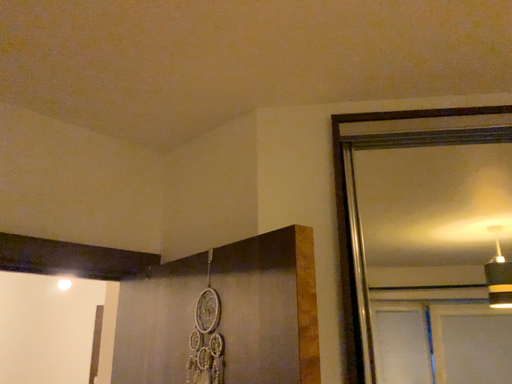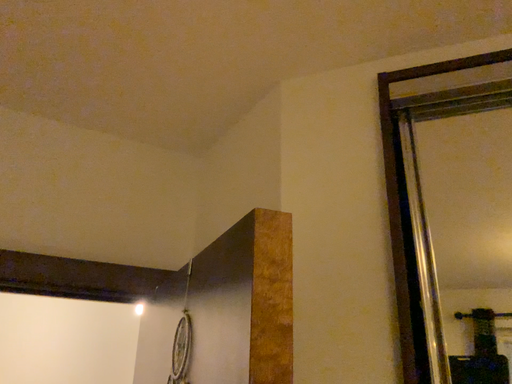
Question: Which way did the camera rotate in the video?

Choices:
 (A) rotated right
 (B) rotated left

Answer: (B)